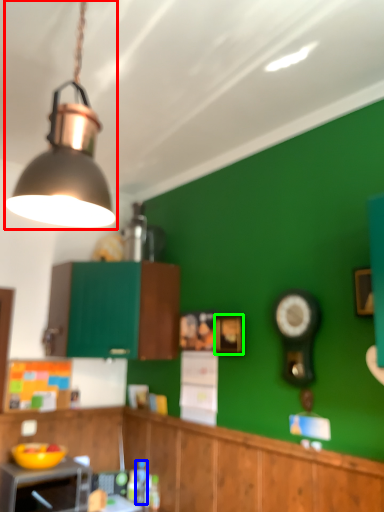
Question: Which object is the closest to the lamp (highlighted by a red box)? Choose among these: bottle (highlighted by a blue box) or picture frame (highlighted by a green box).

Choices:
 (A) bottle
 (B) picture frame

Answer: (B)